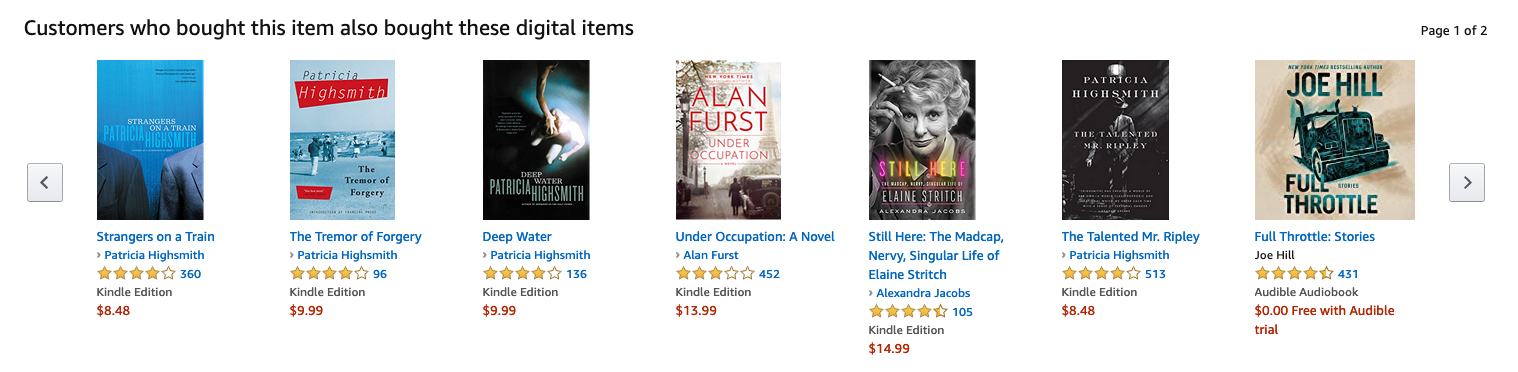
Find the location of a particular element. book is located at coordinates (164, 175), (302, 172), (477, 159), (720, 172), (899, 180), (1066, 180), (1309, 182).